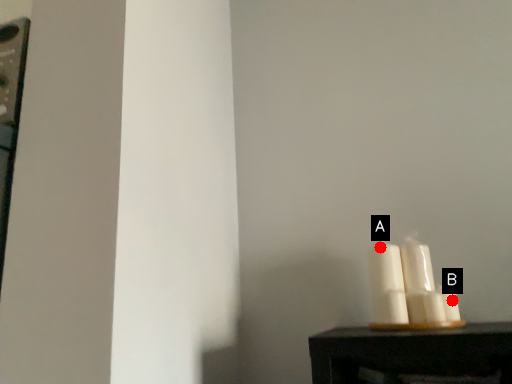
Question: Two points are circled on the image, labeled by A and B beside each circle. Which point is closer to the camera taking this photo?

Choices:
 (A) A is closer
 (B) B is closer

Answer: (B)